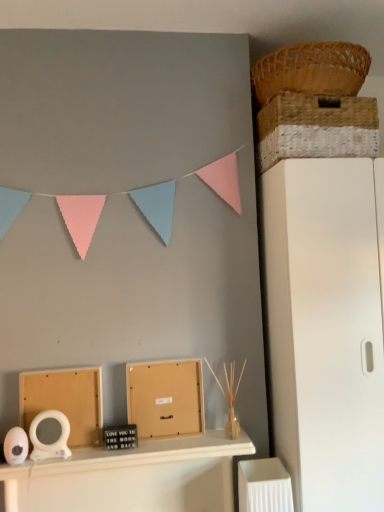
Question: Does woven straw basket at upper right, which appears as the 2th basket when viewed from the top, have a greater height compared to white glossy mirror at center?

Choices:
 (A) no
 (B) yes

Answer: (A)

Question: From the image's perspective, is woven straw basket at upper right, the 1th basket ordered from the bottom, below white glossy mirror at center?

Choices:
 (A) yes
 (B) no

Answer: (B)

Question: Can you confirm if woven straw basket at upper right, the 1th basket ordered from the bottom, is shorter than white glossy mirror at center?

Choices:
 (A) no
 (B) yes

Answer: (B)

Question: From the image's perspective, does woven straw basket at upper right, the 1th basket ordered from the bottom, appear higher than white glossy mirror at center?

Choices:
 (A) no
 (B) yes

Answer: (B)

Question: Is woven straw basket at upper right, which appears as the 2th basket when viewed from the top, smaller than white glossy mirror at center?

Choices:
 (A) no
 (B) yes

Answer: (B)

Question: Considering the relative positions of woven brown basket at upper right, which is the 1th basket from top to bottom, and matte cardboard box at center, acting as the second cardboard box starting from the left, in the image provided, is woven brown basket at upper right, which is the 1th basket from top to bottom, to the left or to the right of matte cardboard box at center, acting as the second cardboard box starting from the left,?

Choices:
 (A) left
 (B) right

Answer: (B)

Question: From the image's perspective, is woven brown basket at upper right, which ranks as the second basket in bottom-to-top order, located above or below matte cardboard box at center, acting as the first cardboard box starting from the right?

Choices:
 (A) below
 (B) above

Answer: (B)

Question: Looking at their shapes, would you say woven brown basket at upper right, which ranks as the second basket in bottom-to-top order, is wider or thinner than matte cardboard box at center, acting as the first cardboard box starting from the right?

Choices:
 (A) thin
 (B) wide

Answer: (B)

Question: Is point (271, 95) positioned closer to the camera than point (127, 367)?

Choices:
 (A) closer
 (B) farther

Answer: (B)

Question: Is woven brown basket at upper right, which ranks as the second basket in bottom-to-top order, taller or shorter than white glossy mirror at center?

Choices:
 (A) tall
 (B) short

Answer: (B)

Question: In terms of size, does woven brown basket at upper right, which ranks as the second basket in bottom-to-top order, appear bigger or smaller than white glossy mirror at center?

Choices:
 (A) small
 (B) big

Answer: (A)

Question: Choose the correct answer: Is woven brown basket at upper right, which is the 1th basket from top to bottom, inside white glossy mirror at center or outside it?

Choices:
 (A) outside
 (B) inside

Answer: (A)

Question: Does point coord(321,51) appear closer or farther from the camera than point coord(139,442)?

Choices:
 (A) closer
 (B) farther

Answer: (A)

Question: From their relative heights in the image, would you say woven straw basket at upper right, the 1th basket ordered from the bottom, is taller or shorter than white matte file cabinet at right?

Choices:
 (A) short
 (B) tall

Answer: (A)

Question: From a real-world perspective, is woven straw basket at upper right, the 1th basket ordered from the bottom, physically located above or below white matte file cabinet at right?

Choices:
 (A) below
 (B) above

Answer: (B)